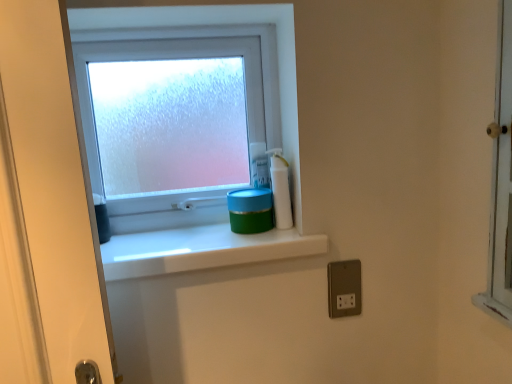
Question: From a real-world perspective, is blue plastic container at upper right physically below white glossy bottle at upper right?

Choices:
 (A) yes
 (B) no

Answer: (B)

Question: Is white glossy bottle at upper right at the back of blue plastic container at upper right?

Choices:
 (A) yes
 (B) no

Answer: (B)

Question: From a real-world perspective, is blue plastic container at upper right located higher than white glossy bottle at upper right?

Choices:
 (A) yes
 (B) no

Answer: (A)

Question: Are blue plastic container at upper right and white glossy bottle at upper right beside each other?

Choices:
 (A) yes
 (B) no

Answer: (A)

Question: Is white glossy bottle at upper right a part of blue plastic container at upper right?

Choices:
 (A) yes
 (B) no

Answer: (B)

Question: Is there a large distance between blue plastic container at upper right and white glossy bottle at upper right?

Choices:
 (A) no
 (B) yes

Answer: (A)

Question: From a real-world perspective, is white glossy bottle at upper right positioned under green matte container at center based on gravity?

Choices:
 (A) yes
 (B) no

Answer: (B)

Question: Can you confirm if white glossy bottle at upper right is bigger than green matte container at center?

Choices:
 (A) yes
 (B) no

Answer: (B)

Question: Does white glossy bottle at upper right have a greater width compared to green matte container at center?

Choices:
 (A) no
 (B) yes

Answer: (A)

Question: Can you confirm if white glossy bottle at upper right is taller than green matte container at center?

Choices:
 (A) no
 (B) yes

Answer: (B)

Question: Can you confirm if white glossy bottle at upper right is positioned to the right of green matte container at center?

Choices:
 (A) no
 (B) yes

Answer: (B)

Question: Considering the relative sizes of white glossy bottle at upper right and green matte container at center in the image provided, is white glossy bottle at upper right smaller than green matte container at center?

Choices:
 (A) yes
 (B) no

Answer: (A)

Question: Does white glossy bottle at upper right come in front of blue plastic container at upper right?

Choices:
 (A) no
 (B) yes

Answer: (B)